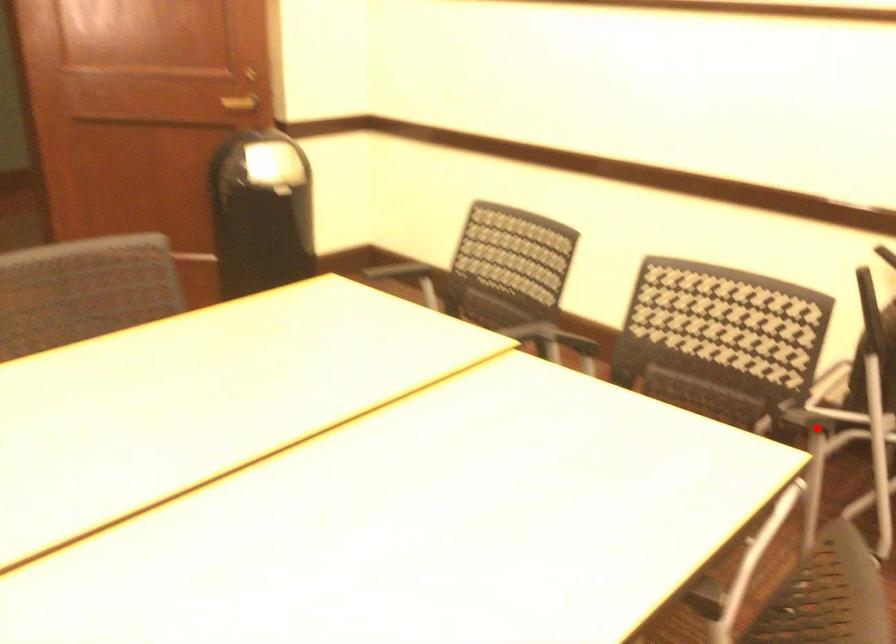
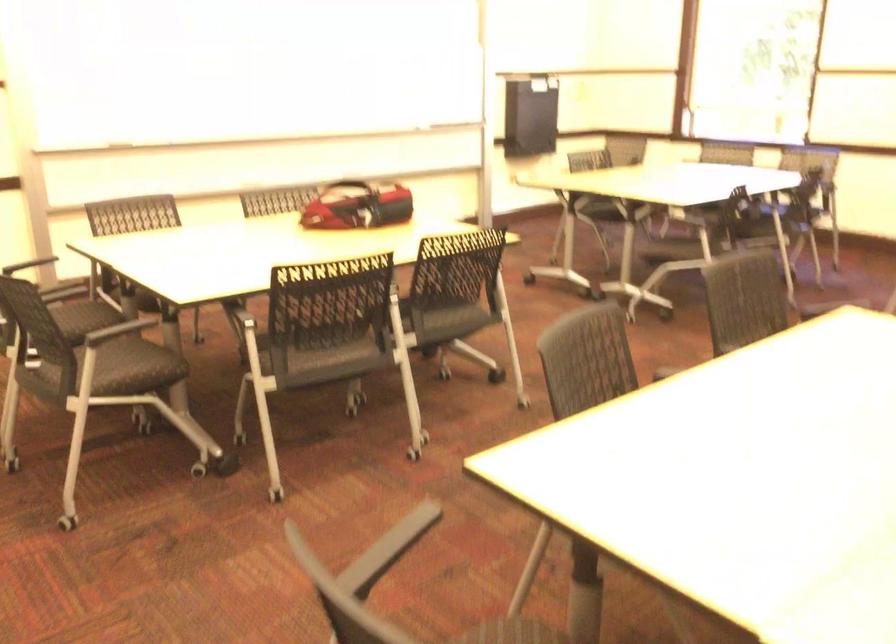
Find the pixel in the second image that matches the highlighted location in the first image.

(389, 549)